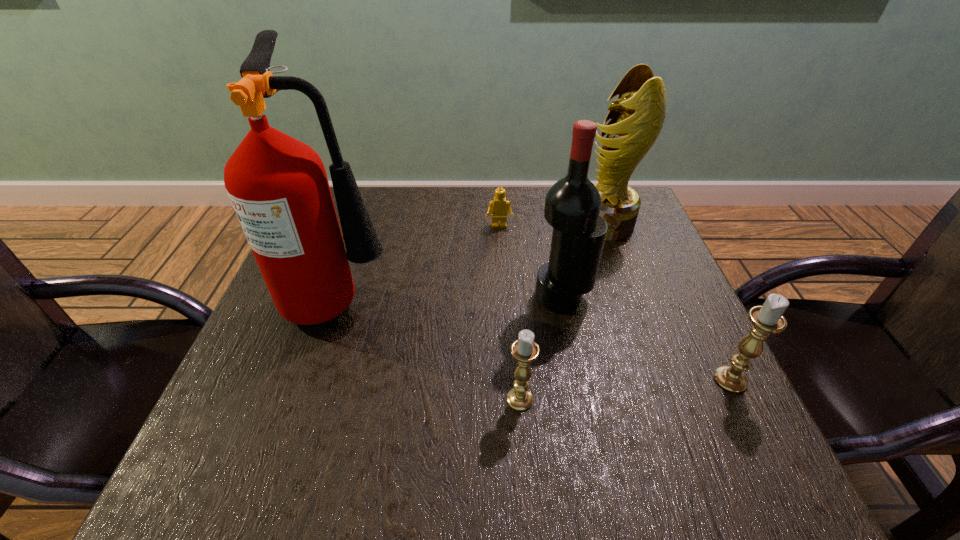
Where is `free space between the third object from right to left and the taller candle holder`? The height and width of the screenshot is (540, 960). free space between the third object from right to left and the taller candle holder is located at coordinates (646, 339).

In order to click on free space between the shorter candle holder and the shortest object in this screenshot , I will do `click(510, 313)`.

Where is `unoccupied area between the tallest object and the Lego`? unoccupied area between the tallest object and the Lego is located at coordinates 420,261.

Locate an element on the screen. free spot between the Lego and the taller candle holder is located at coordinates (614, 303).

This screenshot has height=540, width=960. In order to click on empty space that is in between the fifth object from left to right and the tallest object in this screenshot , I will do click(x=472, y=260).

You are a GUI agent. You are given a task and a screenshot of the screen. Output one action in this format:
    pyautogui.click(x=<x>, y=<y>)
    Task: Click on the vacant space in between the right candle holder and the Lego
    
    Given the screenshot: What is the action you would take?
    pyautogui.click(x=614, y=303)

This screenshot has width=960, height=540. I want to click on free spot between the fifth tallest object and the leftmost object, so click(430, 348).

Image resolution: width=960 pixels, height=540 pixels. I want to click on free point between the leftmost object and the Lego, so click(420, 261).

You are a GUI agent. You are given a task and a screenshot of the screen. Output one action in this format:
    pyautogui.click(x=<x>, y=<y>)
    Task: Click on the free space that is in between the tallest object and the Lego
    The height and width of the screenshot is (540, 960).
    Given the screenshot: What is the action you would take?
    pyautogui.click(x=420, y=261)

What are the coordinates of `the closest object to the leftmost object` in the screenshot? It's located at (498, 207).